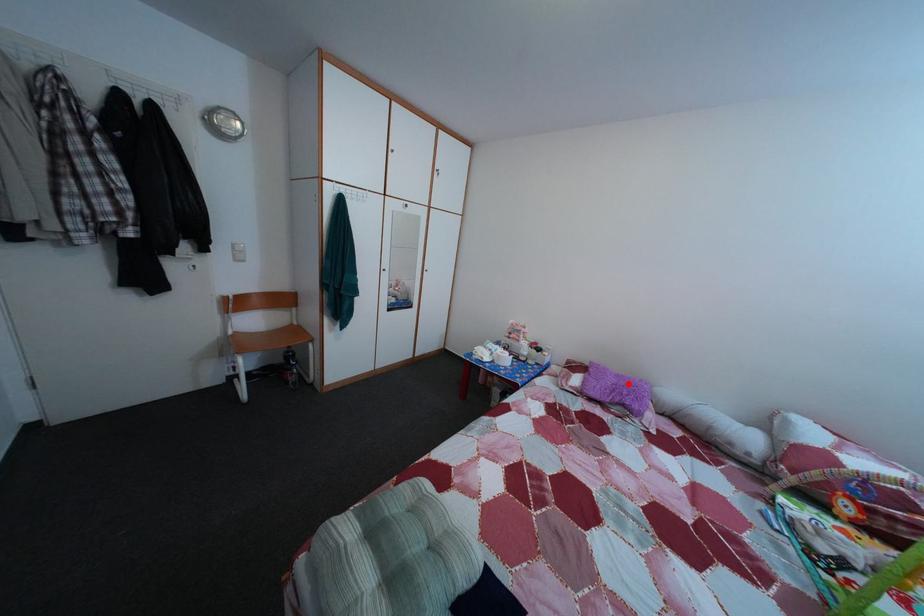
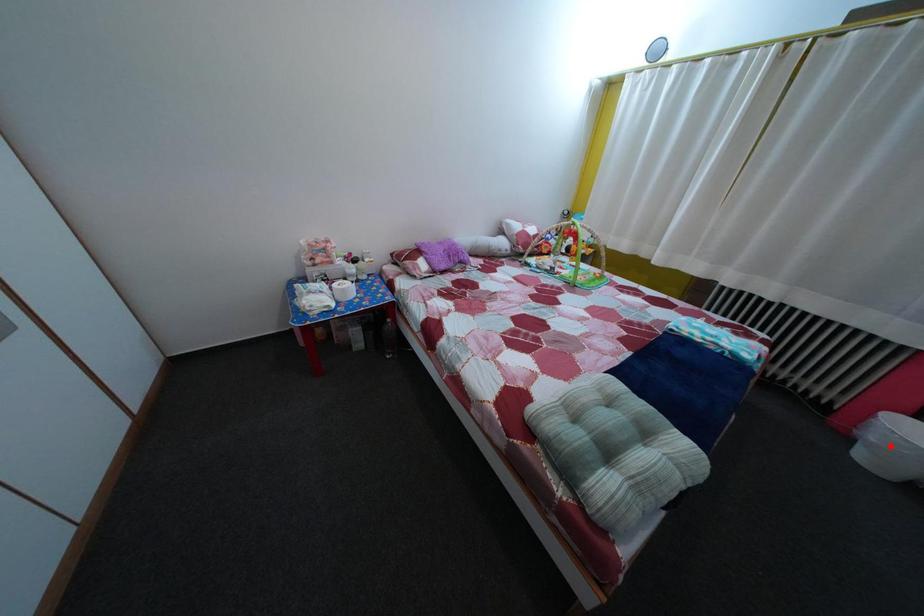
I am providing you with two images of the same scene from different viewpoints. A red point is marked on the first image and another point is marked on the second image. Are the points marked in image1 and image2 representing the same 3D position?

No